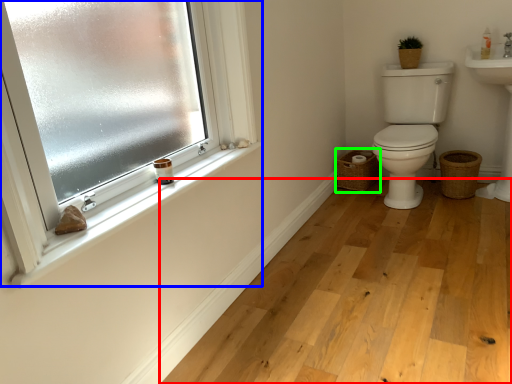
Question: Estimate the real-world distances between objects in this image. Which object is farther from plain (highlighted by a red box), window (highlighted by a blue box) or basket (highlighted by a green box)?

Choices:
 (A) window
 (B) basket

Answer: (A)